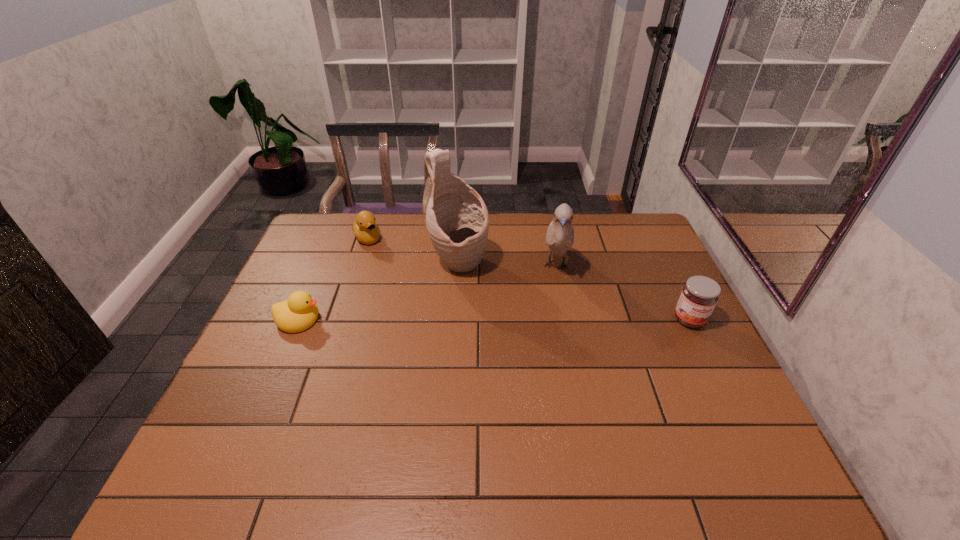
Locate an element on the screen. Image resolution: width=960 pixels, height=540 pixels. free spot on the desktop that is between the nearer duckling and the jam and is positioned facing forward on the taller duckling is located at coordinates (436, 319).

Locate an element on the screen. This screenshot has height=540, width=960. free space on the desktop that is between the left duckling and the rightmost object and is positioned at the spout of the pitcher is located at coordinates (527, 320).

Where is `vacant space on the desktop that is between the leftmost object and the rightmost object and is positioned at the beak of the second tallest object`? vacant space on the desktop that is between the leftmost object and the rightmost object and is positioned at the beak of the second tallest object is located at coordinates (550, 320).